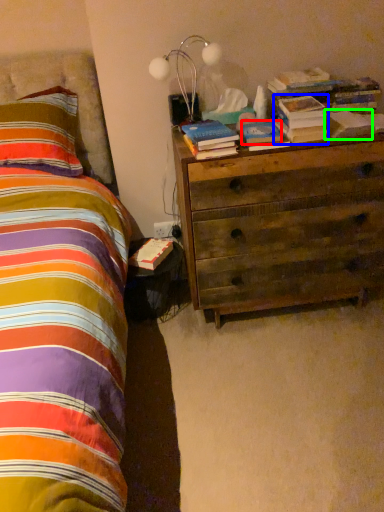
Question: Based on their relative distances, which object is farther from paperback book (highlighted by a red box)? Choose from book (highlighted by a blue box) and paperback book (highlighted by a green box).

Choices:
 (A) book
 (B) paperback book

Answer: (B)